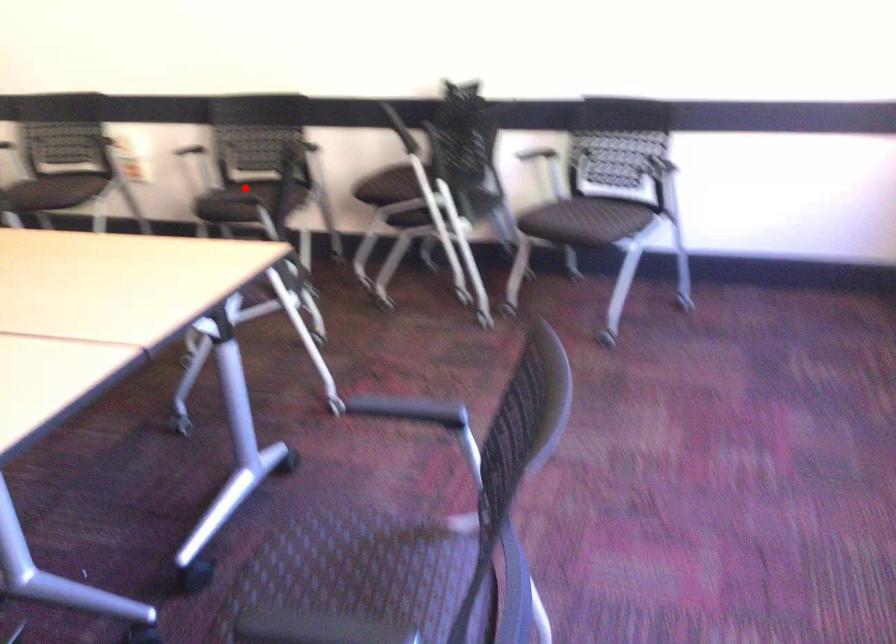
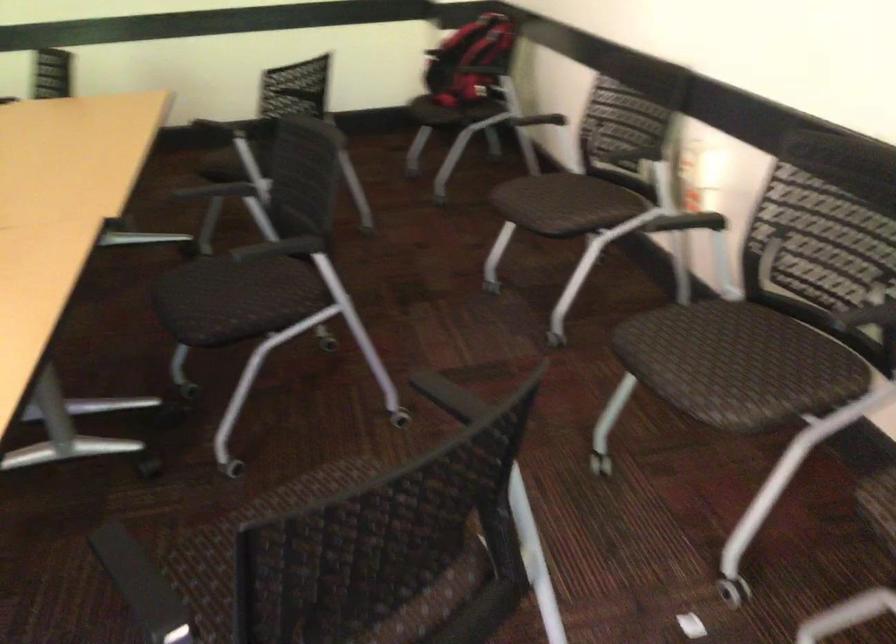
The point at the highlighted location is marked in the first image. Where is the corresponding point in the second image?

(735, 335)